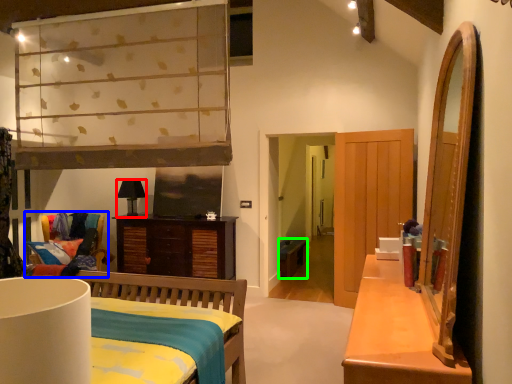
Question: Which object is positioned farthest from lamp (highlighted by a red box)? Select from chair (highlighted by a blue box) and studio couch (highlighted by a green box).

Choices:
 (A) chair
 (B) studio couch

Answer: (B)